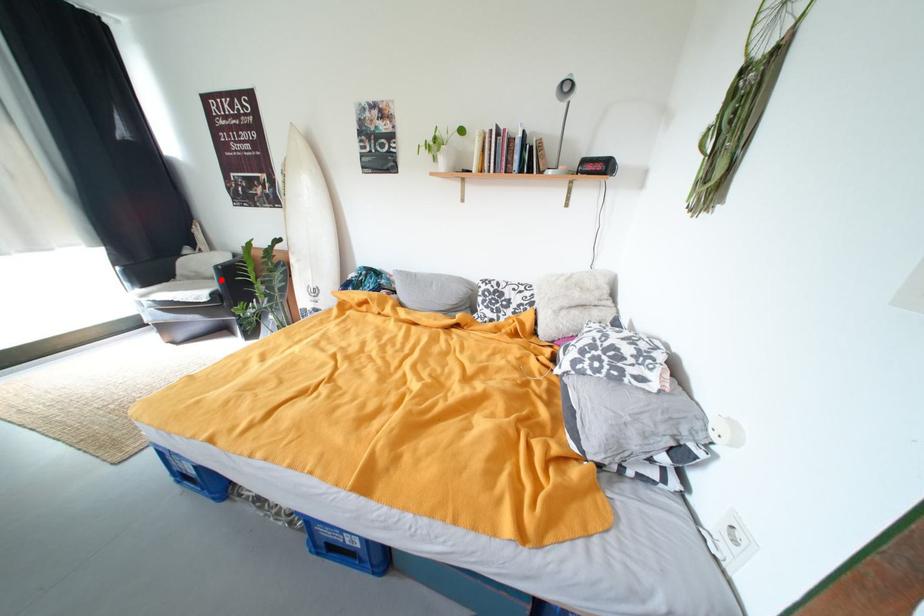
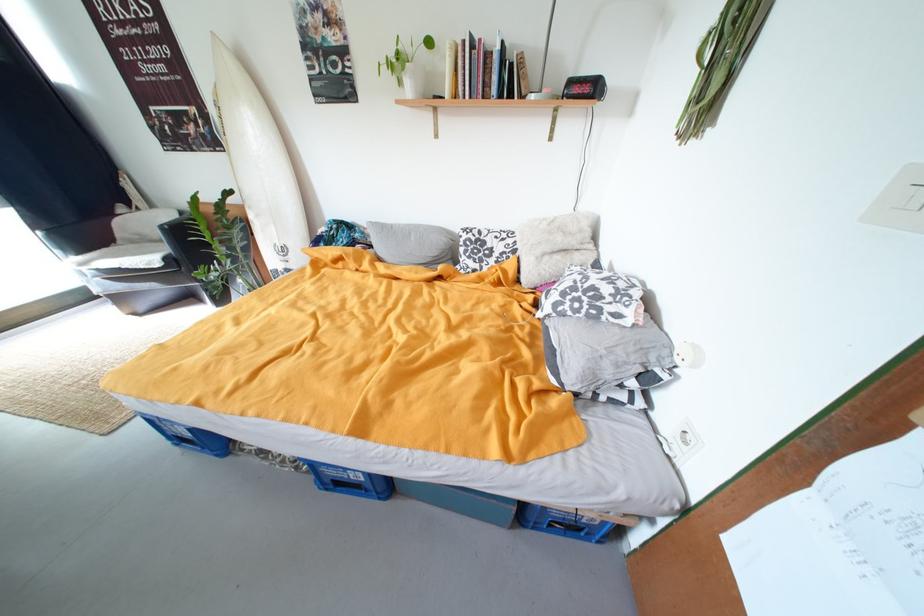
Where in the second image is the point corresponding to the highlighted location from the first image?

(169, 243)